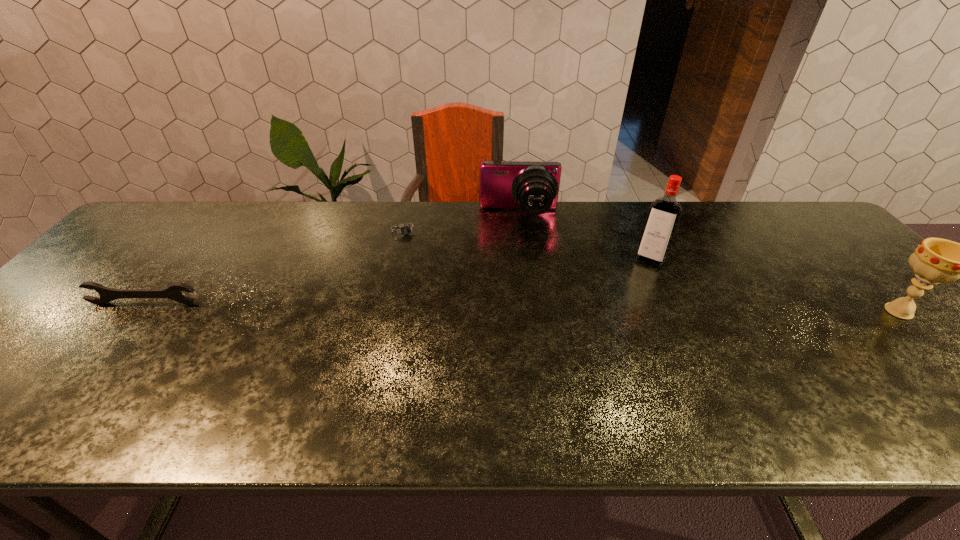
Identify which object is located as the nearest to the wrench. Please provide its 2D coordinates. Your answer should be formatted as a tuple, i.e. [(x, y)], where the tuple contains the x and y coordinates of a point satisfying the conditions above.

[(405, 230)]

Locate an element on the screen. free space that satisfies the following two spatial constraints: 1. on the front side of the shortest object; 2. on the right side of the tallest object is located at coordinates (399, 258).

Locate an element on the screen. The width and height of the screenshot is (960, 540). free spot that satisfies the following two spatial constraints: 1. on the front side of the fourth object from left to right; 2. on the left side of the rightmost object is located at coordinates (676, 312).

Identify the location of free space that satisfies the following two spatial constraints: 1. on the front side of the shortest object; 2. on the left side of the vodka. The image size is (960, 540). (399, 258).

Find the location of a particular element. The height and width of the screenshot is (540, 960). vacant space that satisfies the following two spatial constraints: 1. on the back side of the third object from right to left; 2. on the left side of the second object from left to right is located at coordinates (409, 214).

Locate an element on the screen. free space that satisfies the following two spatial constraints: 1. on the open ends of the fourth shortest object; 2. on the right side of the wrench is located at coordinates (138, 312).